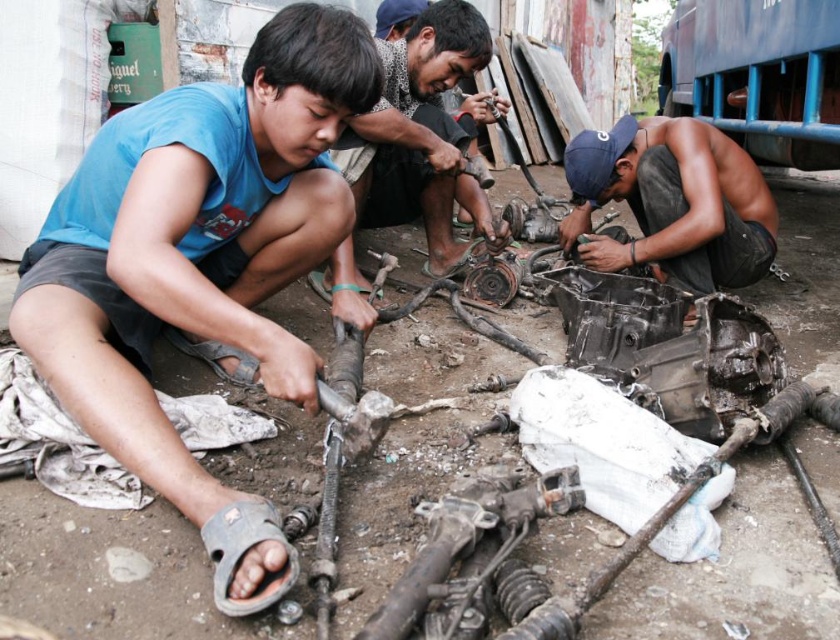
You are a mechanic trying to reach the shiny metallic engine part at center and the matte black engine part at center. Which one can you grab first without moving your position?

The shiny metallic engine part at center is closer to the viewer than the matte black engine part at center, so you can grab it first without moving.

Based on the scene description, which object is closer to the ground, the matte blue shirt at lower left or the matte black engine part at center?

The matte blue shirt at lower left is positioned under the matte black engine part at center, so the matte blue shirt at lower left is closer to the ground.

You are a photographer wanting to capture the entire scene in one shot. Given that the matte blue shirt at lower left and the shiny metallic engine part at center are both in focus, which object will appear bigger in the photo?

The matte blue shirt at lower left will appear bigger in the photo because it is larger in size than the shiny metallic engine part at center.